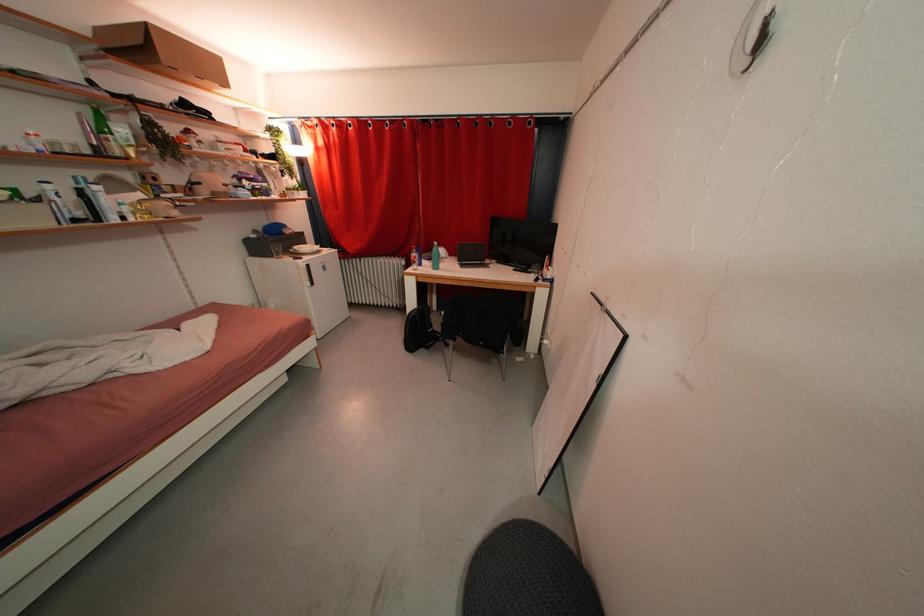
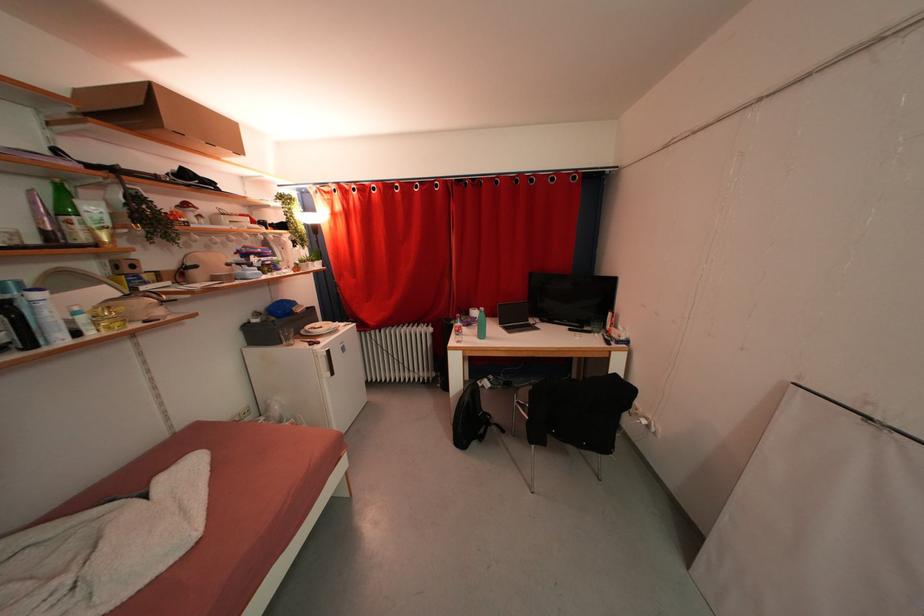
Question: I am providing you with two images of the same scene from different viewpoints. Which of the following objects are not visible in image2?

Choices:
 (A) white ceramic plate
 (B) chair sitting surface
 (C) turquoise water bottle
 (D) none of these

Answer: (D)